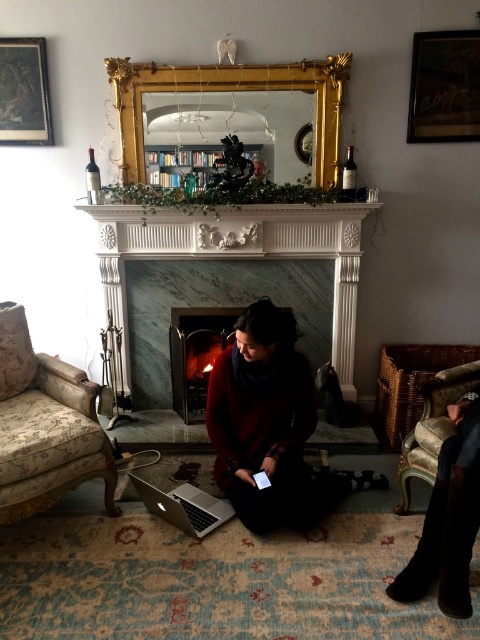
Which of these two, green marble fireplace at center or floral fabric armchair at left, stands shorter?

floral fabric armchair at left

Can you confirm if green marble fireplace at center is smaller than floral fabric armchair at left?

Actually, green marble fireplace at center might be larger than floral fabric armchair at left.

Describe the element at coordinates (238, 252) in the screenshot. I see `green marble fireplace at center` at that location.

Identify the location of green marble fireplace at center. The width and height of the screenshot is (480, 640). (238, 252).

Does floral fabric armchair at left have a lesser width compared to matte black picture frame at upper left?

In fact, floral fabric armchair at left might be wider than matte black picture frame at upper left.

Who is positioned more to the right, floral fabric armchair at left or matte black picture frame at upper left?

Positioned to the right is floral fabric armchair at left.

What are the coordinates of `floral fabric armchair at left` in the screenshot? It's located at (45, 426).

In the scene shown: Who is more forward, (21, 83) or (428, 394)?

Positioned in front is point (428, 394).

Is matte black picture frame at upper left to the right of woven fabric armchair at lower right from the viewer's perspective?

In fact, matte black picture frame at upper left is to the left of woven fabric armchair at lower right.

The height and width of the screenshot is (640, 480). Describe the element at coordinates (24, 92) in the screenshot. I see `matte black picture frame at upper left` at that location.

Identify the location of matte black picture frame at upper left. The height and width of the screenshot is (640, 480). (24, 92).